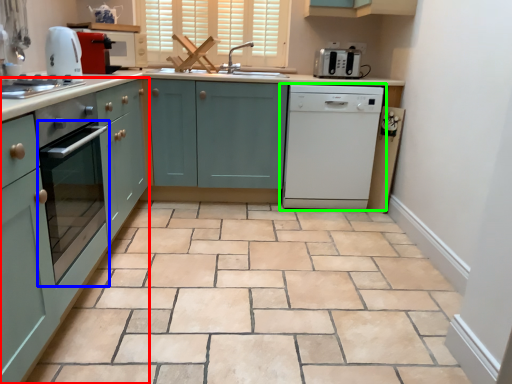
Question: Considering the real-world distances, which object is farthest from cabinetry (highlighted by a red box)? oven (highlighted by a blue box) or home appliance (highlighted by a green box)?

Choices:
 (A) oven
 (B) home appliance

Answer: (B)